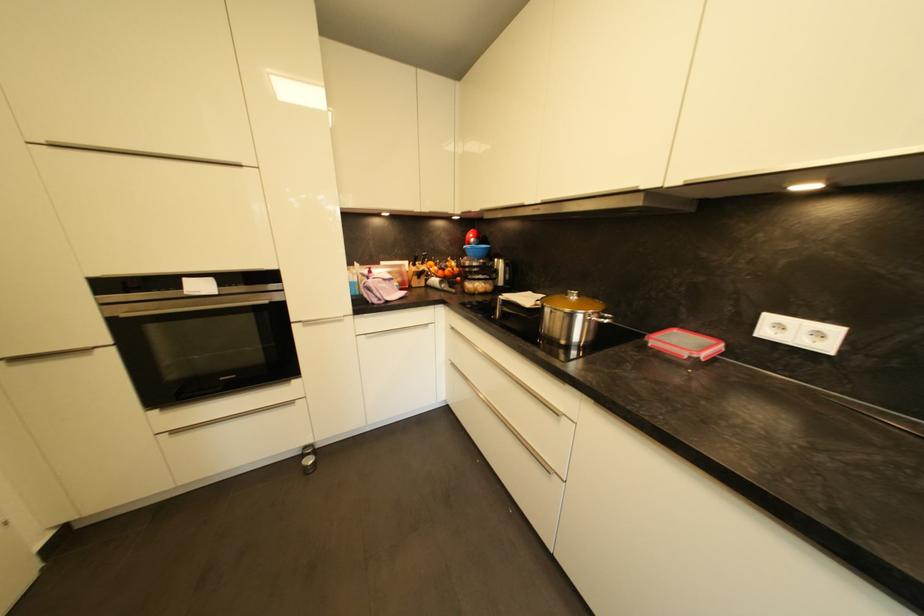
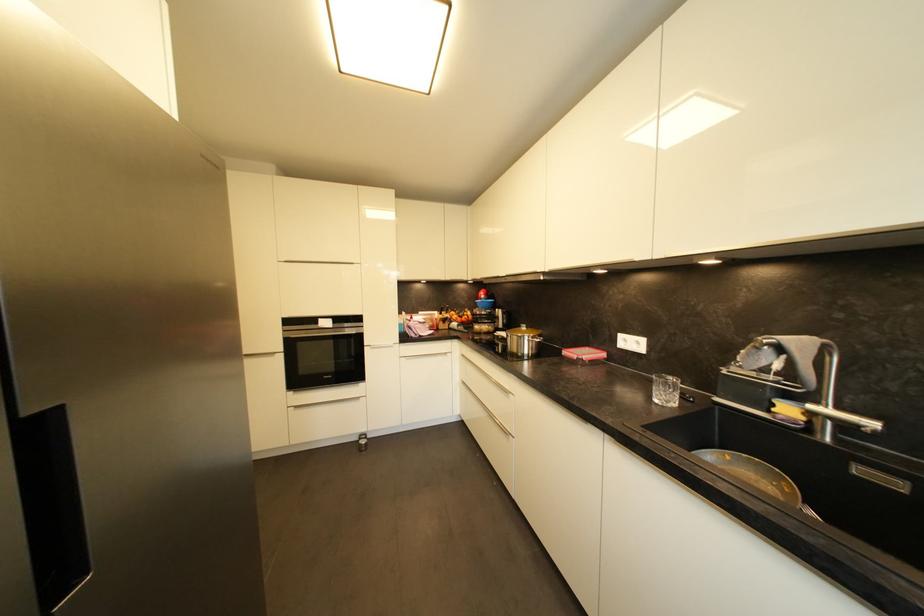
Where in the second image is the point corresponding to [107,307] from the first image?

(289, 333)